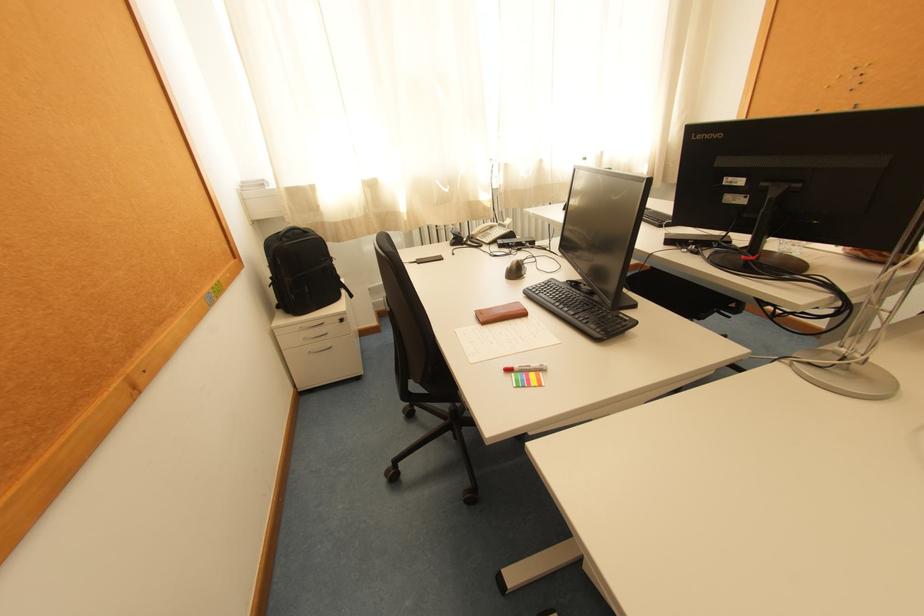
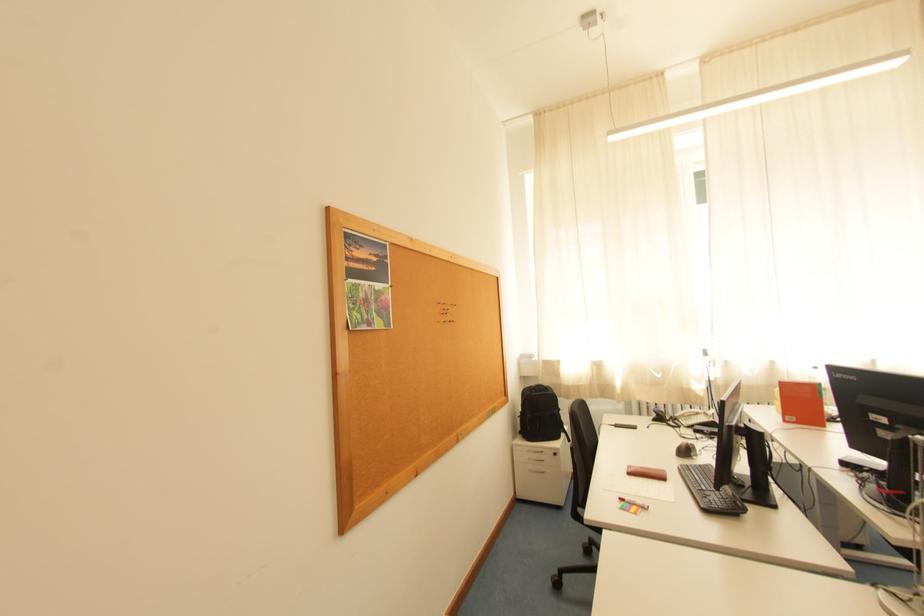
In the second image, find the point that corresponds to the point at 495,233 in the first image.

(699, 418)